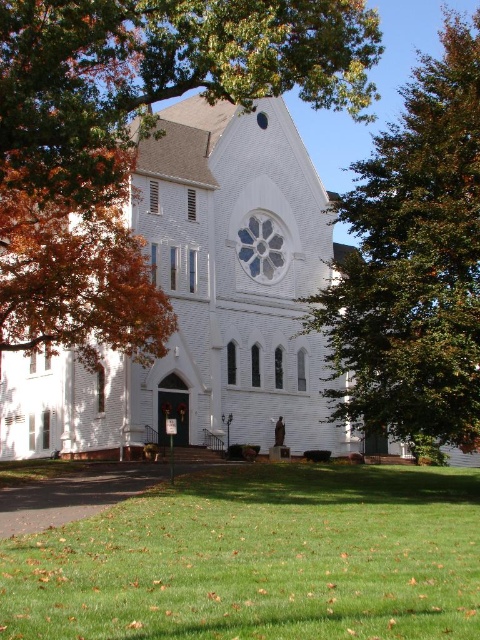
How far apart are green grass at lower center and green leafy tree at upper right?

They are 23.87 meters apart.

Between green grass at lower center and green leafy tree at upper right, which one has more height?

With more height is green leafy tree at upper right.

Does point (406, 589) come in front of point (469, 436)?

Yes, point (406, 589) is closer to viewer.

Find the location of `green grass at lower center`. green grass at lower center is located at coordinates (259, 560).

Is green grass at lower center in front of white brick church at center?

Yes, it is.

Describe the element at coordinates (259, 560) in the screenshot. I see `green grass at lower center` at that location.

Locate an element on the screen. The image size is (480, 640). green grass at lower center is located at coordinates (259, 560).

Which is more to the right, white brick church at center or green leafy tree at upper right?

Positioned to the right is green leafy tree at upper right.

Between white brick church at center and green leafy tree at upper right, which one has less height?

Standing shorter between the two is white brick church at center.

Is point (206, 307) behind point (422, 300)?

Yes, it is.

Locate an element on the screen. white brick church at center is located at coordinates (204, 300).